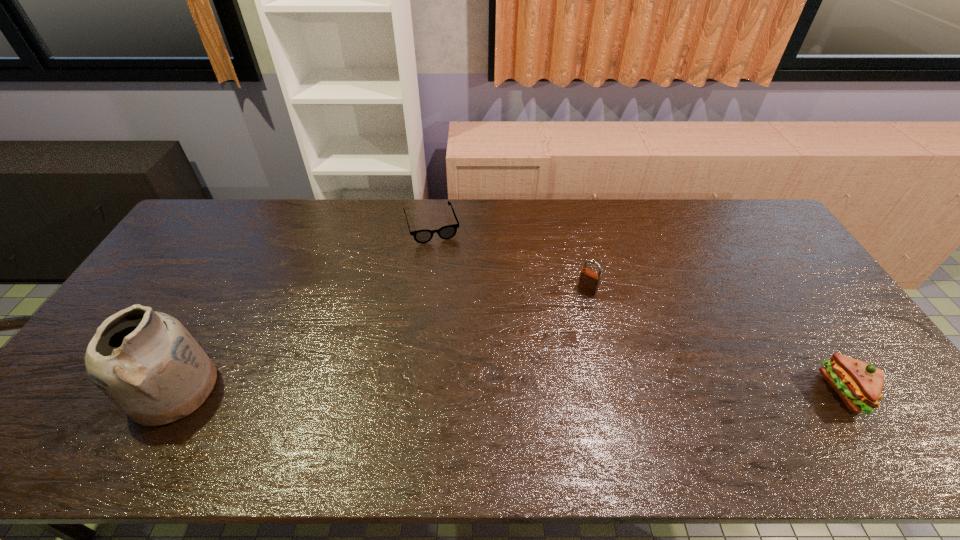
Where is `vacant spot on the desktop that is between the tallest object and the sandwich and is positioned on the arms of the shortest object`? vacant spot on the desktop that is between the tallest object and the sandwich and is positioned on the arms of the shortest object is located at coordinates (484, 390).

You are a GUI agent. You are given a task and a screenshot of the screen. Output one action in this format:
    pyautogui.click(x=<x>, y=<y>)
    Task: Click on the vacant space on the desktop that is between the tallest object and the sandwich and is positioned on the front-facing side of the padlock
    The height and width of the screenshot is (540, 960).
    Given the screenshot: What is the action you would take?
    pyautogui.click(x=506, y=390)